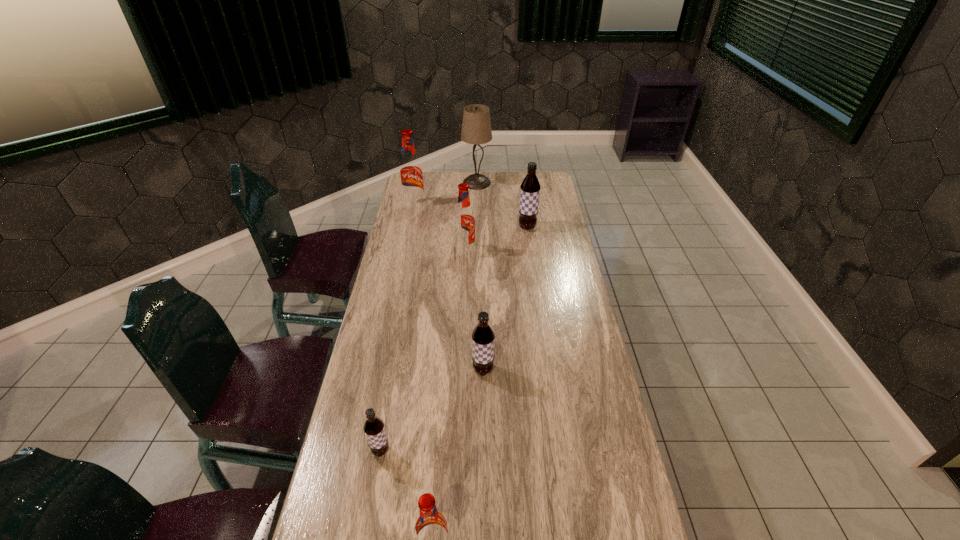
Find the location of a particular element. The height and width of the screenshot is (540, 960). the farthest object is located at coordinates (476, 127).

In order to click on the farthest root beer in this screenshot , I will do `click(411, 177)`.

This screenshot has width=960, height=540. I want to click on the sixth nearest object, so click(411, 177).

The width and height of the screenshot is (960, 540). I want to click on the second smallest red root beer, so click(x=464, y=220).

Where is `the third farthest root beer`? This screenshot has width=960, height=540. the third farthest root beer is located at coordinates [x=464, y=220].

Find the location of a particular element. This screenshot has height=540, width=960. the rightmost root beer is located at coordinates (530, 187).

Where is `the rightmost brown root beer`? The height and width of the screenshot is (540, 960). the rightmost brown root beer is located at coordinates (530, 187).

Find the location of a particular element. the fourth farthest root beer is located at coordinates (483, 336).

Locate an element on the screen. The height and width of the screenshot is (540, 960). the second biggest brown root beer is located at coordinates (483, 336).

Where is `the shortest root beer`? Image resolution: width=960 pixels, height=540 pixels. the shortest root beer is located at coordinates (374, 429).